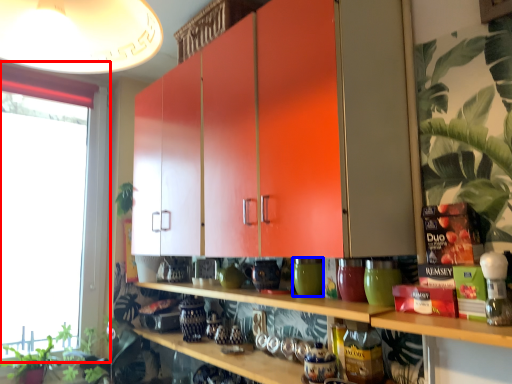
Question: Among these objects, which one is nearest to the camera, window (highlighted by a red box) or pottery (highlighted by a blue box)?

Choices:
 (A) window
 (B) pottery

Answer: (B)